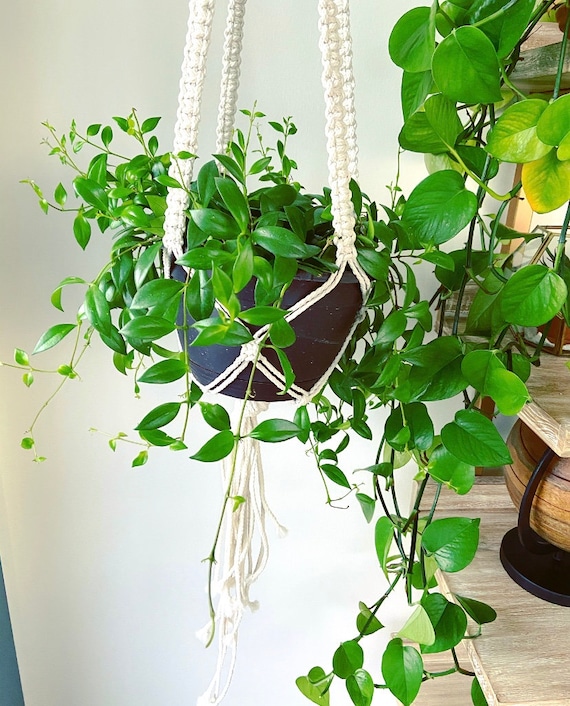
Identify the location of hanging plant. This screenshot has width=570, height=706. (276, 222).